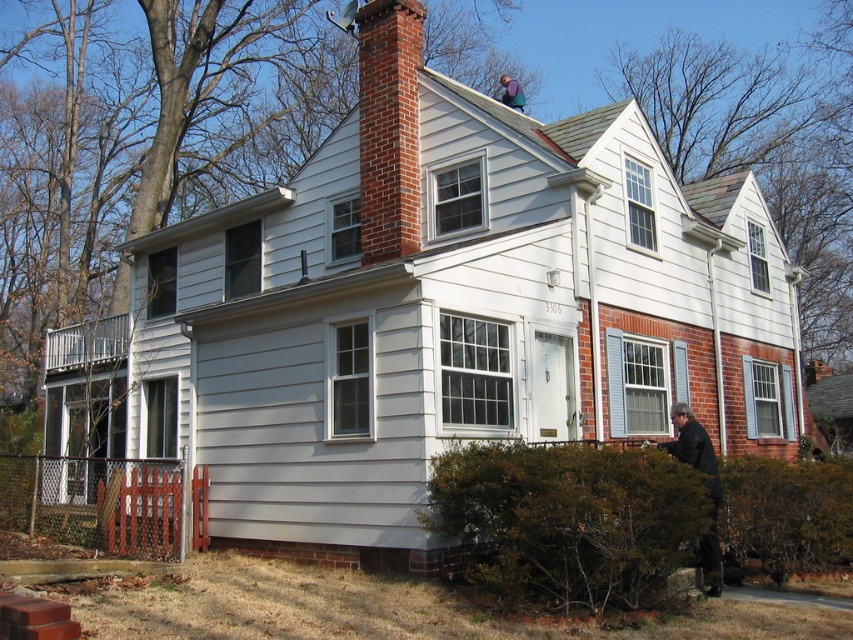
You are a delivery person trying to find the correct house address. You see the dark gray jacket at lower right and the blue denim jacket at upper center. Which jacket is closer to you?

The dark gray jacket at lower right is closer to you because it is in front of the blue denim jacket at upper center.

You are a delivery person trying to place a package on the porch. The porch is located on the left side of the house, partially hidden by the red picket fence. The package needs to be placed where it can be seen from the front door. Considering the brick chimney at center and the dark gray jacket at lower right, which object is closer to the front door?

The brick chimney at center is closer to the front door than the dark gray jacket at lower right. Since the chimney is shorter, it doesn